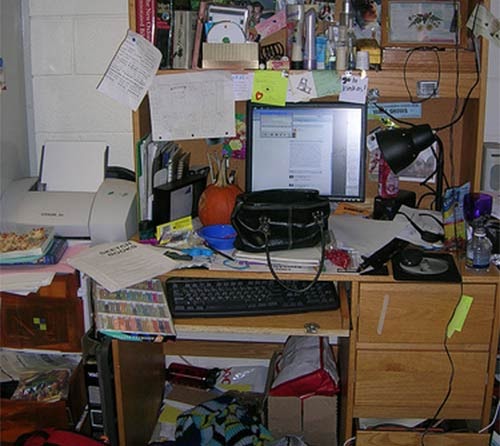
Where is `monitor`? Image resolution: width=500 pixels, height=446 pixels. monitor is located at coordinates (297, 144).